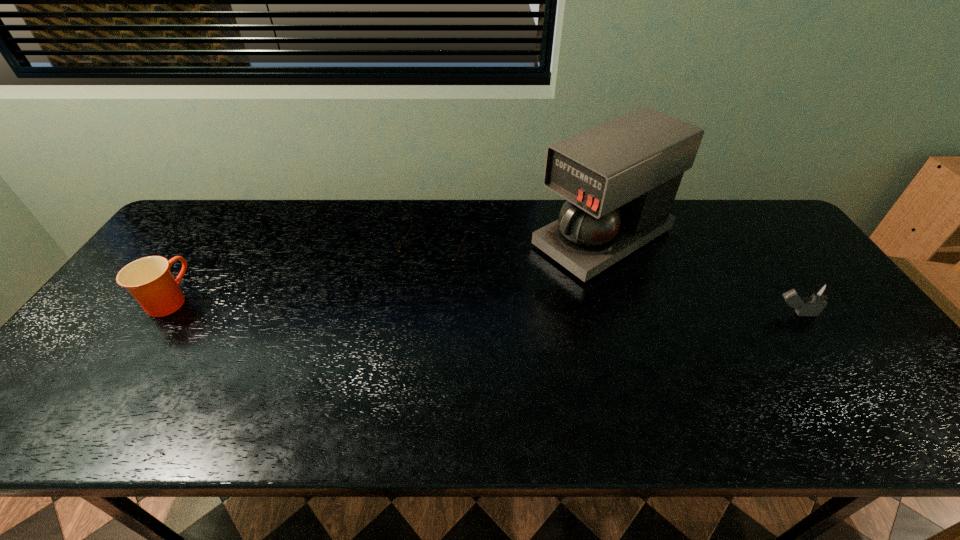
The image size is (960, 540). Identify the location of blank space at the left edge of the desktop. (94, 351).

This screenshot has height=540, width=960. I want to click on blank area at the right edge, so click(x=807, y=269).

You are a GUI agent. You are given a task and a screenshot of the screen. Output one action in this format:
    pyautogui.click(x=<x>, y=<y>)
    Task: Click on the free space at the far right corner of the desktop
    This screenshot has height=540, width=960.
    Given the screenshot: What is the action you would take?
    (x=732, y=201)

This screenshot has width=960, height=540. Find the location of `free spot between the tallest object and the spectacles`. free spot between the tallest object and the spectacles is located at coordinates pos(519,245).

This screenshot has height=540, width=960. Find the location of `free space between the tallest object and the second object from left to right`. free space between the tallest object and the second object from left to right is located at coordinates (519, 245).

Locate an element on the screen. This screenshot has width=960, height=540. empty location between the third object from left to right and the igniter is located at coordinates (699, 276).

Locate an element on the screen. The height and width of the screenshot is (540, 960). vacant region between the rightmost object and the spectacles is located at coordinates click(614, 283).

Locate an element on the screen. This screenshot has width=960, height=540. free space between the igniter and the shortest object is located at coordinates (614, 283).

Find the location of `free space between the spectacles and the second object from right to left`. free space between the spectacles and the second object from right to left is located at coordinates (519, 245).

At what (x,y) coordinates should I click in order to perform the action: click on blank region between the leftmost object and the spectacles. Please return your answer as a coordinate pair (x, y). The width and height of the screenshot is (960, 540). Looking at the image, I should click on (302, 276).